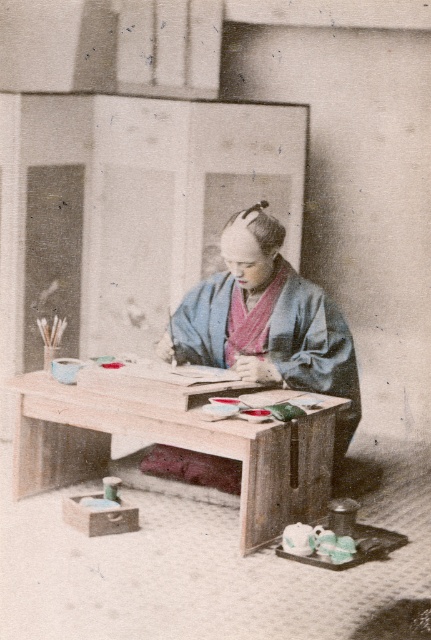
Does wooden table at center come in front of blue silk kimono at center?

Yes, it is in front of blue silk kimono at center.

Is wooden table at center bigger than blue silk kimono at center?

Yes, wooden table at center is bigger than blue silk kimono at center.

Is point (227, 394) farther from camera compared to point (312, 369)?

That is False.

You are a GUI agent. You are given a task and a screenshot of the screen. Output one action in this format:
    pyautogui.click(x=<x>, y=<y>)
    Task: Click on the wooden table at center
    The image size is (431, 640).
    Given the screenshot: What is the action you would take?
    pyautogui.click(x=178, y=444)